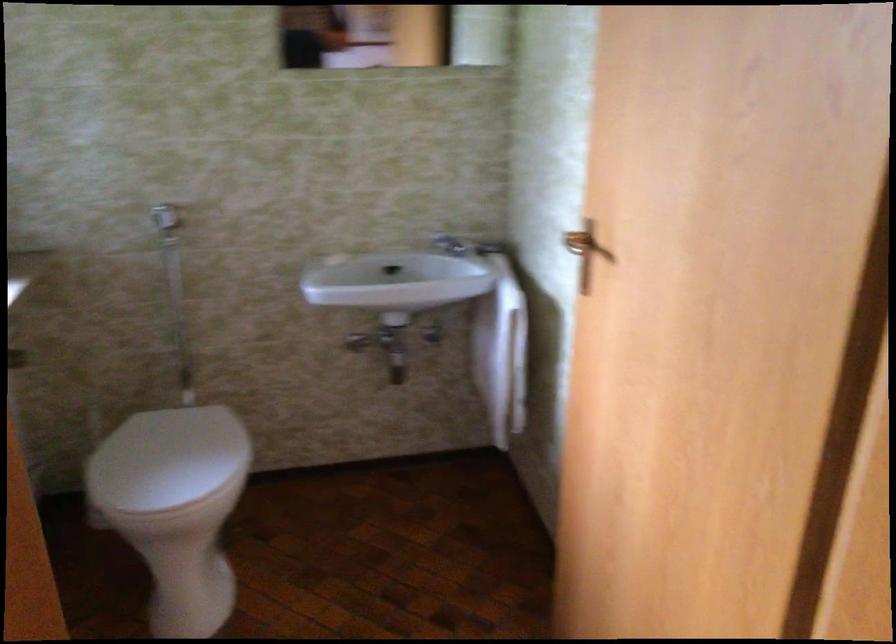
This screenshot has width=896, height=644. What do you see at coordinates (167, 460) in the screenshot? I see `the white toilet lid` at bounding box center [167, 460].